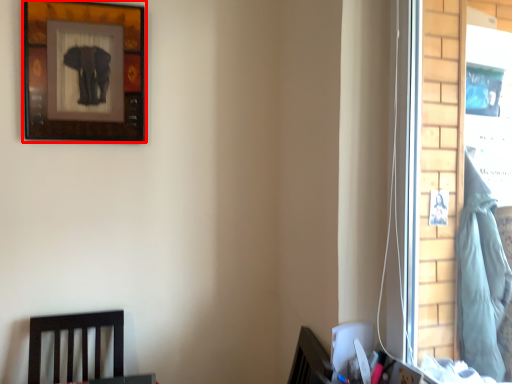
Question: From the image's perspective, where is picture frame (annotated by the red box) located relative to laundry?

Choices:
 (A) above
 (B) below

Answer: (A)